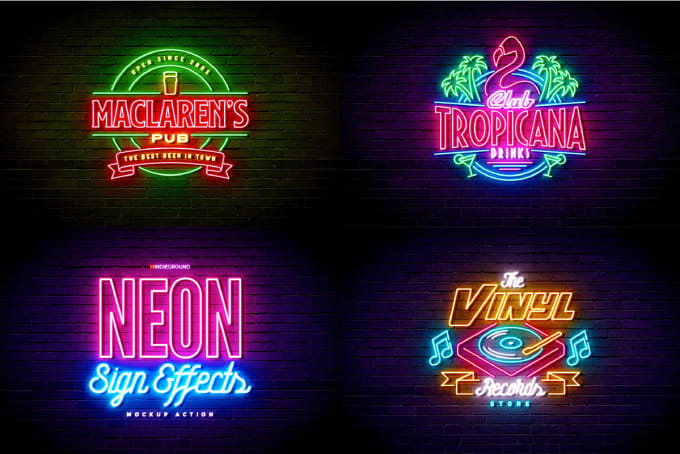
Identify the location of maclaren's pub sign. This screenshot has width=680, height=454. (156, 118).